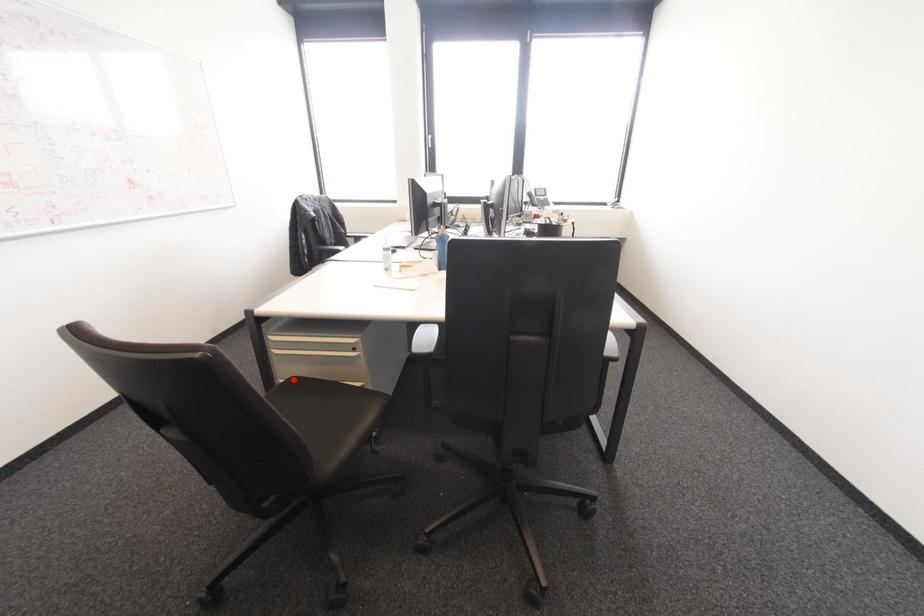
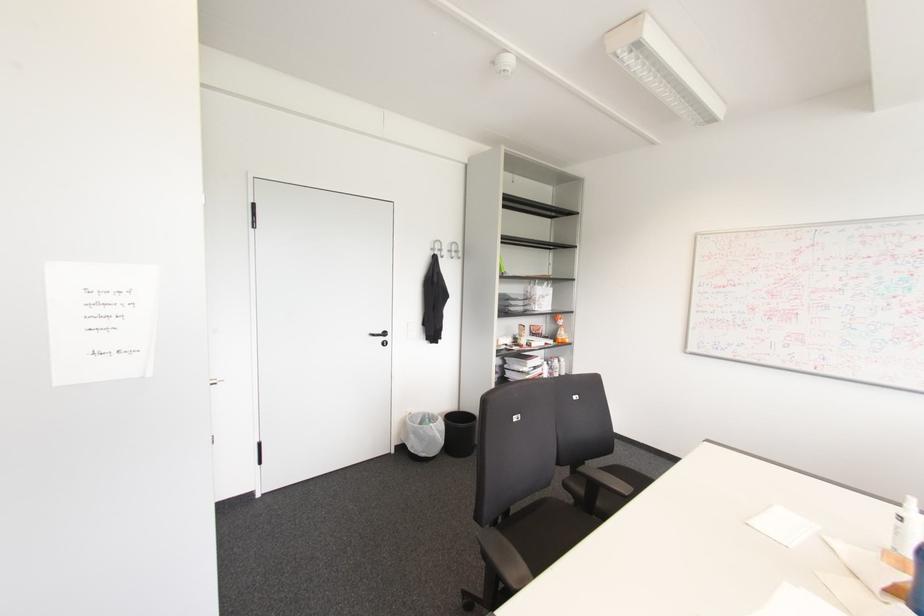
Question: I am providing you with two images of the same scene from different viewpoints. A red point is marked on the first image. At the location where the point appears in image 1, is it still visible in image 2?

Choices:
 (A) Yes
 (B) No

Answer: (B)